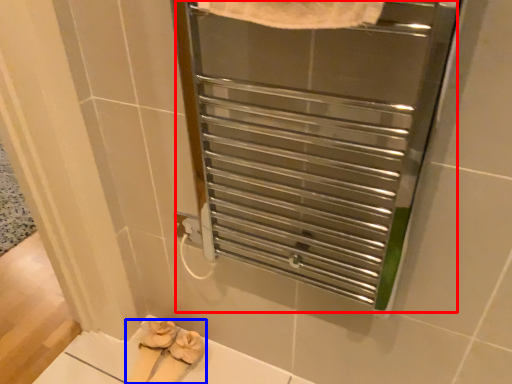
Question: Which of the following is the closest to the observer, screen door (highlighted by a red box) or footwear (highlighted by a blue box)?

Choices:
 (A) screen door
 (B) footwear

Answer: (A)